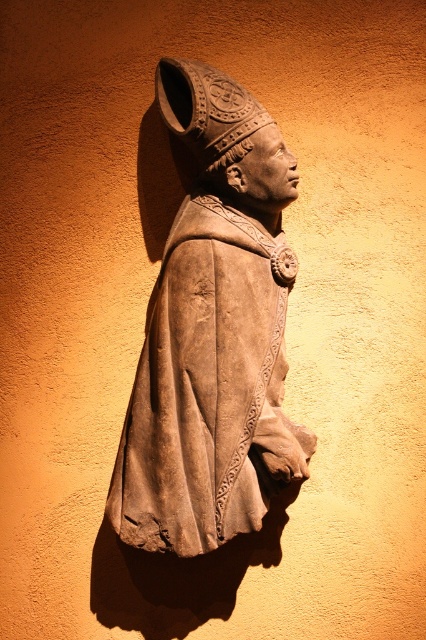
Question: Among these objects, which one is nearest to the camera?

Choices:
 (A) brown stone head at center
 (B) brown stone statue at center

Answer: (B)

Question: Is brown stone statue at center wider than brown stone head at center?

Choices:
 (A) yes
 (B) no

Answer: (A)

Question: Is brown stone statue at center closer to camera compared to brown stone head at center?

Choices:
 (A) yes
 (B) no

Answer: (A)

Question: Which point appears closest to the camera in this image?

Choices:
 (A) coord(186,80)
 (B) coord(256,429)

Answer: (A)

Question: Can you confirm if brown stone statue at center is bigger than brown stone head at center?

Choices:
 (A) no
 (B) yes

Answer: (B)